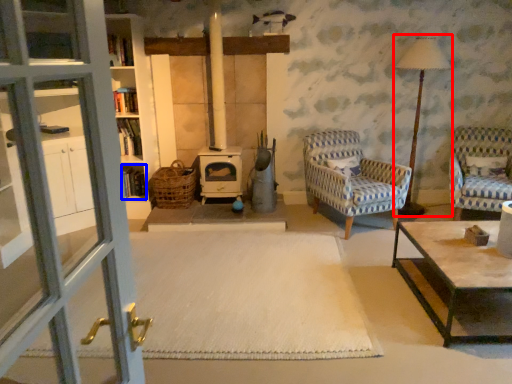
Question: Which object appears farthest to the camera in this image, table lamp (highlighted by a red box) or shelf (highlighted by a blue box)?

Choices:
 (A) table lamp
 (B) shelf

Answer: (B)